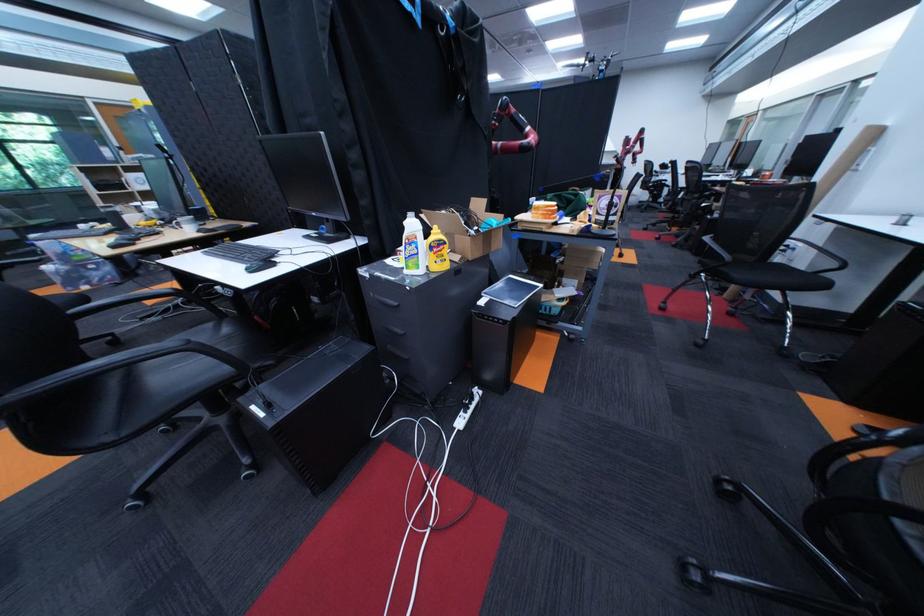
Which object does [436,251] point to?

It corresponds to the yellow plastic bottle in the image.